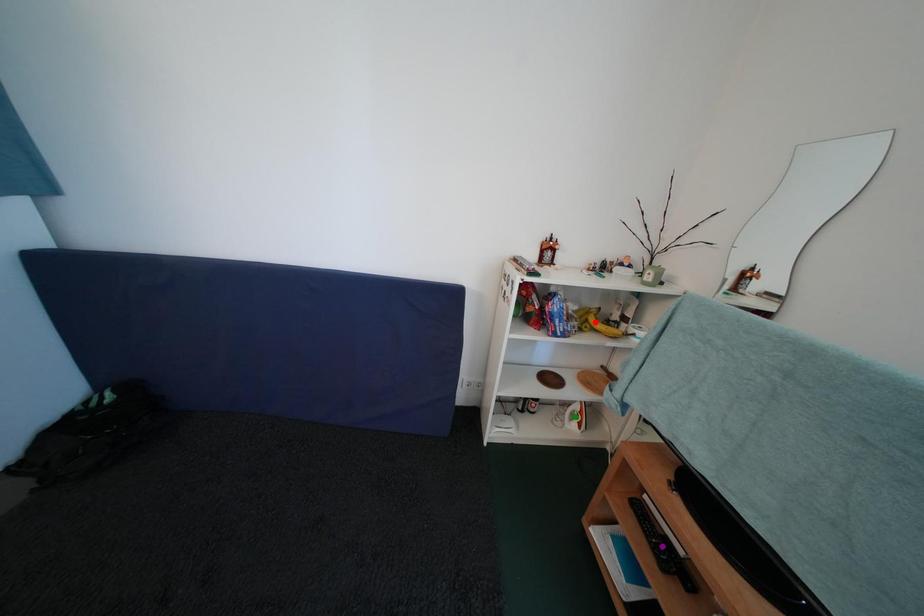
Order these from nearest to farthest:
red point, purple point, green point

1. green point
2. red point
3. purple point